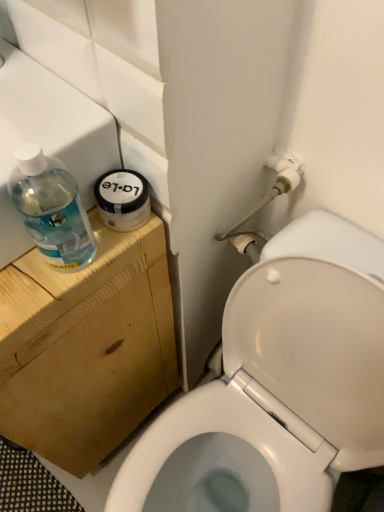
Question: Considering the positions of point (264, 250) and point (62, 115), is point (264, 250) closer or farther from the camera than point (62, 115)?

Choices:
 (A) farther
 (B) closer

Answer: (A)

Question: Relative to transparent plastic sink at upper left, the first sink viewed from the back, is white glossy toilet at lower right in front or behind?

Choices:
 (A) behind
 (B) front

Answer: (B)

Question: Which object is positioned farthest from the transparent plastic bottle at left?

Choices:
 (A) transparent plastic sink at upper left, which appears as the 2th sink when viewed from the front
 (B) white glossy toilet at lower right
 (C) transparent plastic sink at upper left, the 2th sink in the back-to-front sequence

Answer: (B)

Question: Considering the real-world distances, which object is farthest from the transparent plastic sink at upper left, positioned as the first sink in front-to-back order?

Choices:
 (A) transparent plastic sink at upper left, which appears as the 2th sink when viewed from the front
 (B) white glossy toilet at lower right
 (C) transparent plastic bottle at left

Answer: (B)